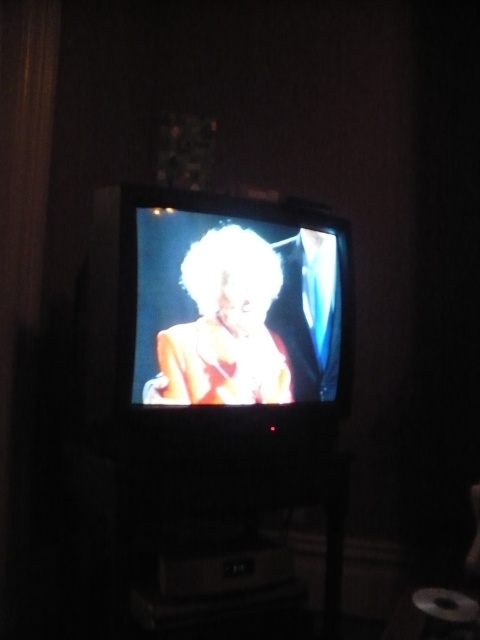
Is shiny black television at center to the left of shiny gold dress at center from the viewer's perspective?

Indeed, shiny black television at center is positioned on the left side of shiny gold dress at center.

Which of these two, shiny black television at center or shiny gold dress at center, stands shorter?

shiny gold dress at center

Is point (333, 396) positioned after point (241, 289)?

That is True.

Locate an element on the screen. shiny black television at center is located at coordinates (215, 314).